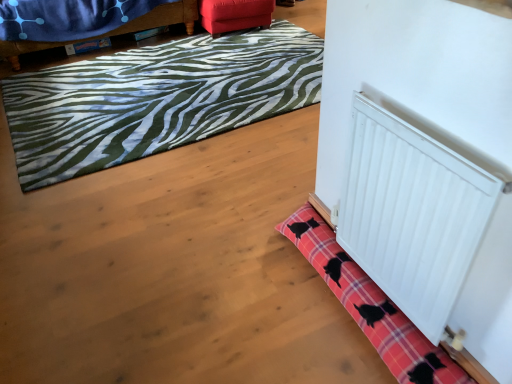
Locate an element on the screen. The width and height of the screenshot is (512, 384). free region under white smooth radiator at lower right (from a real-world perspective) is located at coordinates (388, 299).